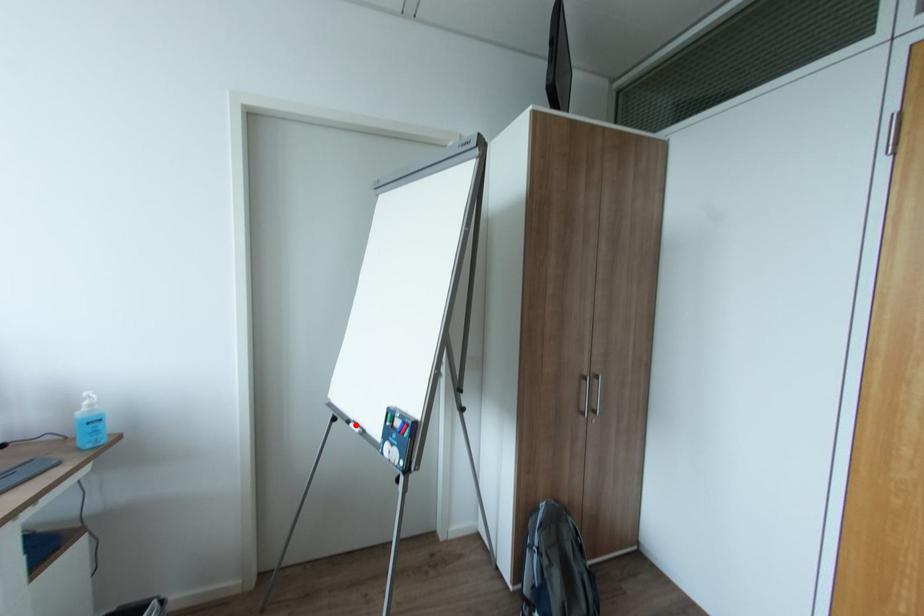
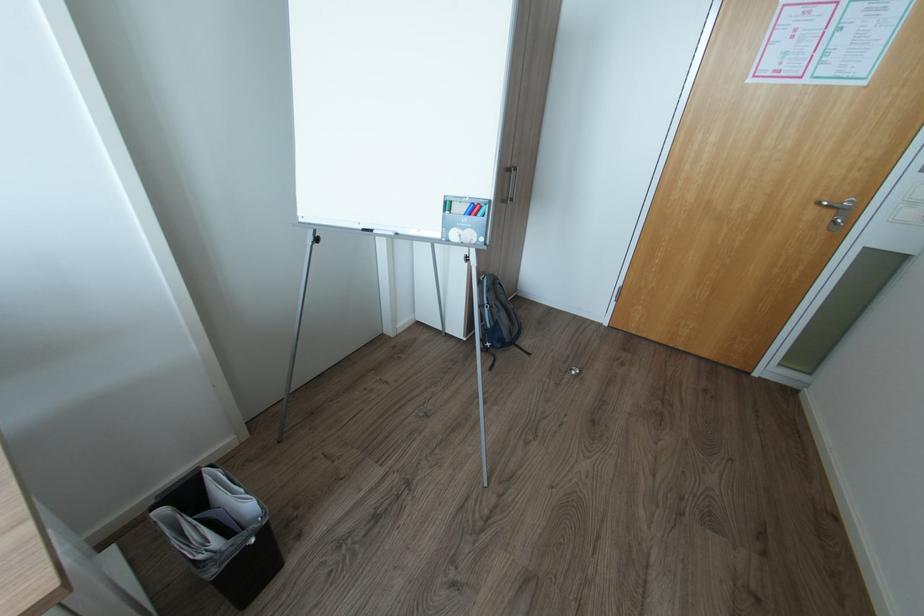
Where in the second image is the point corresponding to the highlighted location from the first image?

(380, 231)